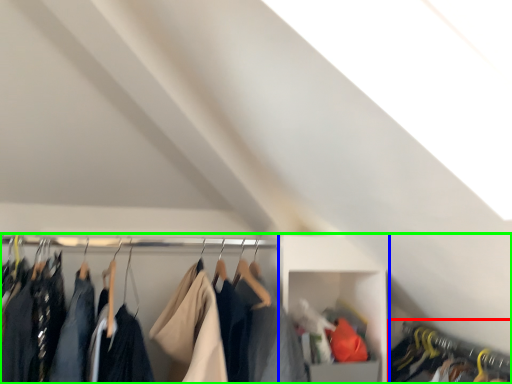
Question: Estimate the real-world distances between objects in this image. Which object is closer to closet (highlighted by a red box), cabinet (highlighted by a blue box) or closet (highlighted by a green box)?

Choices:
 (A) cabinet
 (B) closet

Answer: (A)